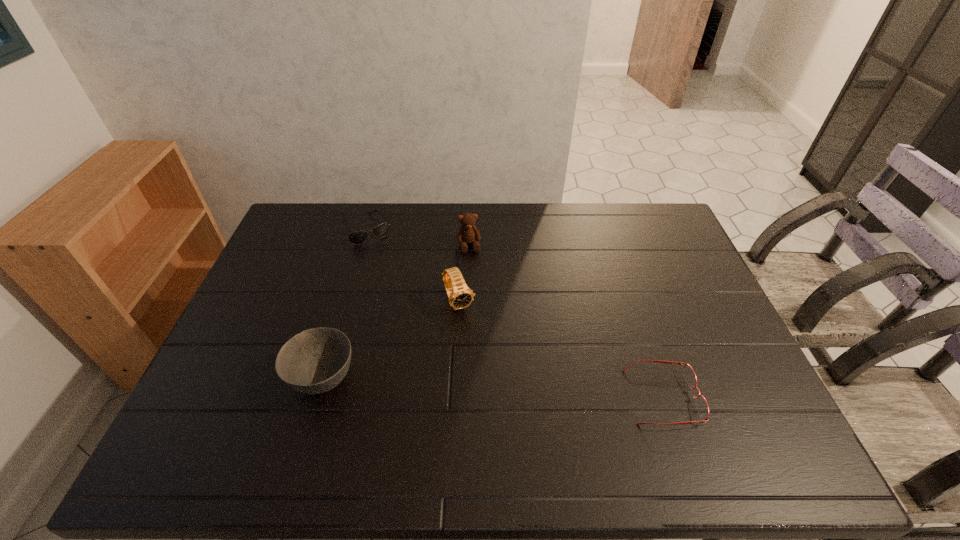
Locate an element on the screen. The width and height of the screenshot is (960, 540). bowl is located at coordinates (316, 360).

Where is `spectacles`? spectacles is located at coordinates (689, 374).

Find the location of a particular element. the shortest object is located at coordinates (689, 374).

Locate an element on the screen. This screenshot has width=960, height=540. teddy bear is located at coordinates (468, 233).

Image resolution: width=960 pixels, height=540 pixels. I want to click on the third farthest object, so click(x=460, y=297).

Where is `the fourth tallest object`? This screenshot has height=540, width=960. the fourth tallest object is located at coordinates (356, 238).

Locate an element on the screen. vacant space located on the back of the bowl is located at coordinates (339, 328).

The width and height of the screenshot is (960, 540). Identify the location of free location located 0.090m on the lenses of the shortest object. (732, 397).

Where is `vacant space situated 0.170m on the face of the teddy bear`? This screenshot has height=540, width=960. vacant space situated 0.170m on the face of the teddy bear is located at coordinates (478, 290).

I want to click on vacant space located 0.050m on the face of the teddy bear, so click(x=472, y=264).